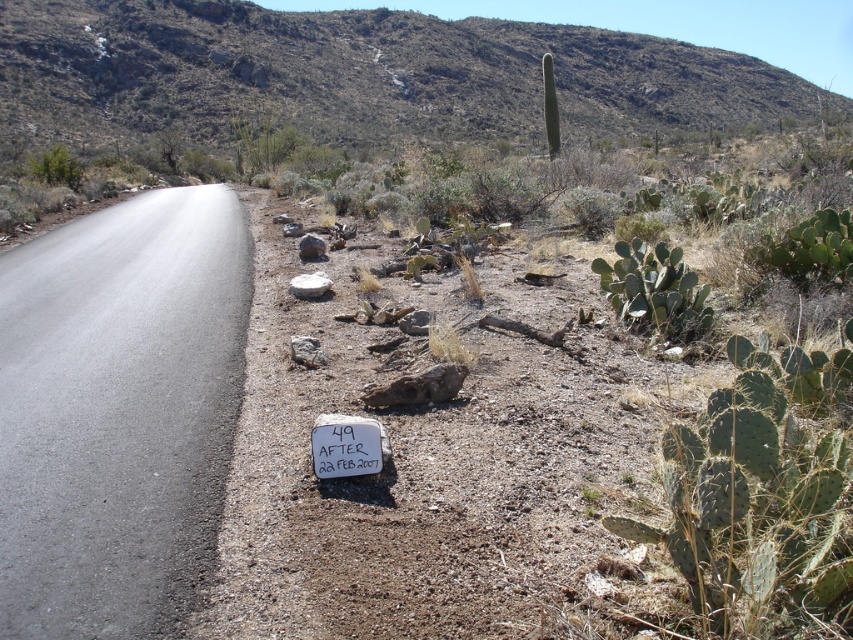
Locate an element on the screen. The height and width of the screenshot is (640, 853). green spiny cactus at upper center is located at coordinates (550, 106).

Locate an element on the screen. green spiny cactus at upper center is located at coordinates (550, 106).

Is white smooth rock at center shorter than gray rock at center?

Yes, white smooth rock at center is shorter than gray rock at center.

Who is lower down, white smooth rock at center or gray rock at center?

white smooth rock at center is lower down.

Describe the element at coordinates (309, 285) in the screenshot. This screenshot has width=853, height=640. I see `white smooth rock at center` at that location.

Identify the location of white smooth rock at center. (309, 285).

Who is more forward, (303, 296) or (296, 342)?

Point (296, 342) is more forward.

Does white smooth rock at center have a greater height compared to gray rough rock at center?

Indeed, white smooth rock at center has a greater height compared to gray rough rock at center.

What do you see at coordinates (309, 285) in the screenshot? I see `white smooth rock at center` at bounding box center [309, 285].

The width and height of the screenshot is (853, 640). Identify the location of white smooth rock at center. (309, 285).